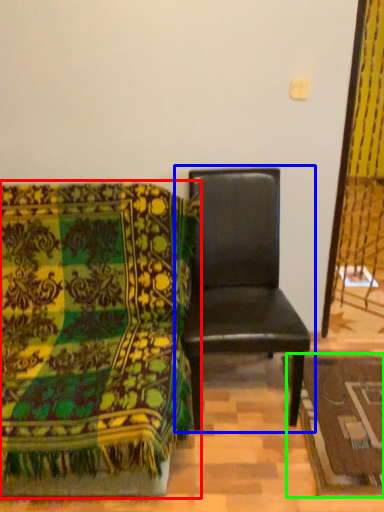
Question: Considering the real-world distances, which object is closest to chair (highlighted by a red box)? chair (highlighted by a blue box) or mat (highlighted by a green box).

Choices:
 (A) chair
 (B) mat

Answer: (A)